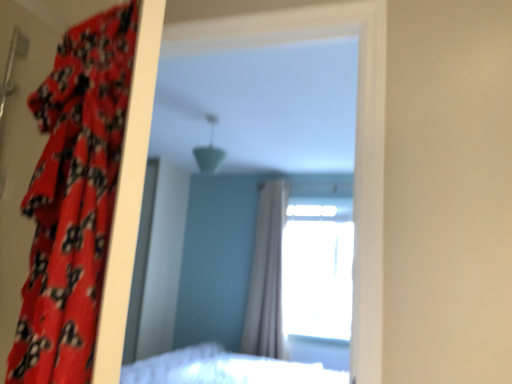
Question: Is transparent glass window at upper center outside white sheer curtain at center, arranged as the 1th curtain when viewed from the right?

Choices:
 (A) no
 (B) yes

Answer: (B)

Question: Does transparent glass window at upper center appear on the right side of white sheer curtain at center, placed as the second curtain when sorted from left to right?

Choices:
 (A) yes
 (B) no

Answer: (A)

Question: Is transparent glass window at upper center closer to camera compared to white sheer curtain at center, placed as the second curtain when sorted from left to right?

Choices:
 (A) no
 (B) yes

Answer: (A)

Question: Is transparent glass window at upper center not near white sheer curtain at center, arranged as the 1th curtain when viewed from the right?

Choices:
 (A) yes
 (B) no

Answer: (B)

Question: From the image's perspective, is transparent glass window at upper center over white sheer curtain at center, positioned as the 1th curtain in back-to-front order?

Choices:
 (A) no
 (B) yes

Answer: (B)

Question: Is transparent glass window at upper center taller or shorter than red floral fabric curtain at left, placed as the second curtain when sorted from right to left?

Choices:
 (A) short
 (B) tall

Answer: (B)

Question: From a real-world perspective, is transparent glass window at upper center above or below red floral fabric curtain at left, the 1th curtain viewed from the front?

Choices:
 (A) above
 (B) below

Answer: (B)

Question: Choose the correct answer: Is transparent glass window at upper center inside red floral fabric curtain at left, the first curtain from the left, or outside it?

Choices:
 (A) inside
 (B) outside

Answer: (B)

Question: In terms of size, does transparent glass window at upper center appear bigger or smaller than red floral fabric curtain at left, placed as the second curtain when sorted from right to left?

Choices:
 (A) small
 (B) big

Answer: (B)

Question: Visually, is red floral fabric curtain at left, the first curtain from the left, positioned to the left or to the right of white sheer curtain at center, arranged as the 1th curtain when viewed from the right?

Choices:
 (A) left
 (B) right

Answer: (A)

Question: Is point (1, 41) positioned closer to the camera than point (259, 206)?

Choices:
 (A) farther
 (B) closer

Answer: (B)

Question: Is red floral fabric curtain at left, the 2th curtain positioned from the back, wider or thinner than white sheer curtain at center, positioned as the 1th curtain in back-to-front order?

Choices:
 (A) thin
 (B) wide

Answer: (B)

Question: From the image's perspective, is red floral fabric curtain at left, placed as the second curtain when sorted from right to left, located above or below white sheer curtain at center, placed as the second curtain when sorted from left to right?

Choices:
 (A) below
 (B) above

Answer: (B)

Question: Is white sheer curtain at center, the 2th curtain viewed from the front, taller or shorter than red floral fabric curtain at left, the first curtain from the left?

Choices:
 (A) short
 (B) tall

Answer: (B)

Question: Is white sheer curtain at center, the 2th curtain viewed from the front, spatially inside red floral fabric curtain at left, placed as the second curtain when sorted from right to left, or outside of it?

Choices:
 (A) inside
 (B) outside

Answer: (B)